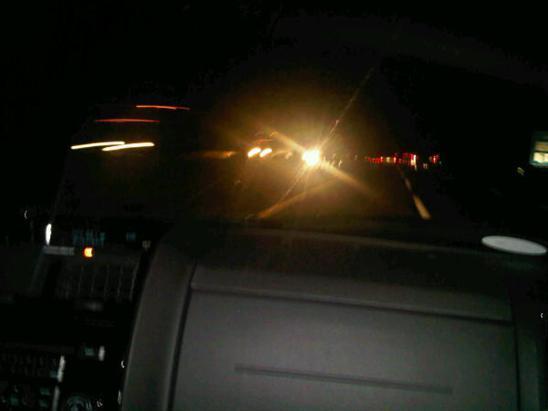
This screenshot has width=548, height=411. Identify the location of light. (253, 151).